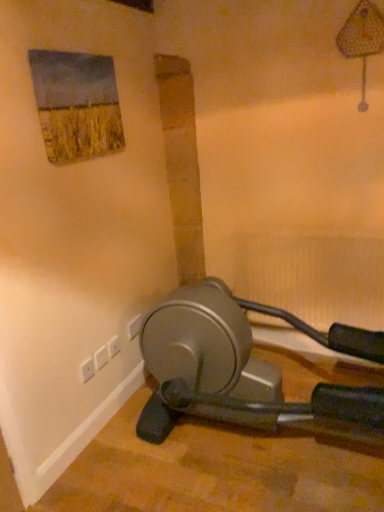
Question: Are white plastic plug at lower left and white plastic electric outlet at lower left, the first electric outlet when ordered from left to right, making contact?

Choices:
 (A) yes
 (B) no

Answer: (A)

Question: From the image's perspective, is white plastic plug at lower left located beneath white plastic electric outlet at lower left, the 3th electric outlet positioned from the back?

Choices:
 (A) no
 (B) yes

Answer: (A)

Question: Does white plastic plug at lower left have a lesser height compared to white plastic electric outlet at lower left, the third electric outlet positioned from the right?

Choices:
 (A) no
 (B) yes

Answer: (A)

Question: From a real-world perspective, is white plastic plug at lower left on top of white plastic electric outlet at lower left, which is the first electric outlet in front-to-back order?

Choices:
 (A) no
 (B) yes

Answer: (A)

Question: Considering the relative sizes of white plastic plug at lower left and white plastic electric outlet at lower left, which is the first electric outlet in front-to-back order, in the image provided, is white plastic plug at lower left taller than white plastic electric outlet at lower left, which is the first electric outlet in front-to-back order,?

Choices:
 (A) no
 (B) yes

Answer: (B)

Question: Is white plastic electric outlet at lower left, which ranks as the 2th electric outlet in left-to-right order, spatially inside white plastic plug at lower left, or outside of it?

Choices:
 (A) outside
 (B) inside

Answer: (A)

Question: Considering the positions of white plastic electric outlet at lower left, positioned as the 2th electric outlet in front-to-back order, and white plastic plug at lower left in the image, is white plastic electric outlet at lower left, positioned as the 2th electric outlet in front-to-back order, taller or shorter than white plastic plug at lower left?

Choices:
 (A) tall
 (B) short

Answer: (B)

Question: Is point (117, 348) closer or farther from the camera than point (97, 366)?

Choices:
 (A) closer
 (B) farther

Answer: (B)

Question: From a real-world perspective, relative to white plastic plug at lower left, is white plastic electric outlet at lower left, the second electric outlet in the back-to-front sequence, vertically above or below?

Choices:
 (A) above
 (B) below

Answer: (A)

Question: From the image's perspective, is white plastic electric outlet at lower left, which ranks as the 2th electric outlet in left-to-right order, located above or below white plastic electric outlet at lower left, which is the first electric outlet in front-to-back order?

Choices:
 (A) above
 (B) below

Answer: (A)

Question: In terms of width, does white plastic electric outlet at lower left, which ranks as the 2th electric outlet in left-to-right order, look wider or thinner when compared to white plastic electric outlet at lower left, the first electric outlet when ordered from left to right?

Choices:
 (A) thin
 (B) wide

Answer: (A)

Question: Would you say white plastic electric outlet at lower left, which ranks as the 2th electric outlet in left-to-right order, is inside or outside white plastic electric outlet at lower left, the first electric outlet when ordered from left to right?

Choices:
 (A) inside
 (B) outside

Answer: (B)

Question: Is white plastic electric outlet at lower left, the second electric outlet in the back-to-front sequence, to the left or to the right of white plastic electric outlet at lower left, the 3th electric outlet positioned from the back, in the image?

Choices:
 (A) right
 (B) left

Answer: (A)

Question: Considering their positions, is white plastic electric outlet at lower left, the third electric outlet positioned from the right, located in front of or behind white plastic electric outlet at lower left, arranged as the 3th electric outlet when viewed from the left?

Choices:
 (A) behind
 (B) front

Answer: (B)

Question: In terms of size, does white plastic electric outlet at lower left, the 3th electric outlet positioned from the back, appear bigger or smaller than white plastic electric outlet at lower left, which appears as the 3th electric outlet when viewed from the front?

Choices:
 (A) small
 (B) big

Answer: (A)